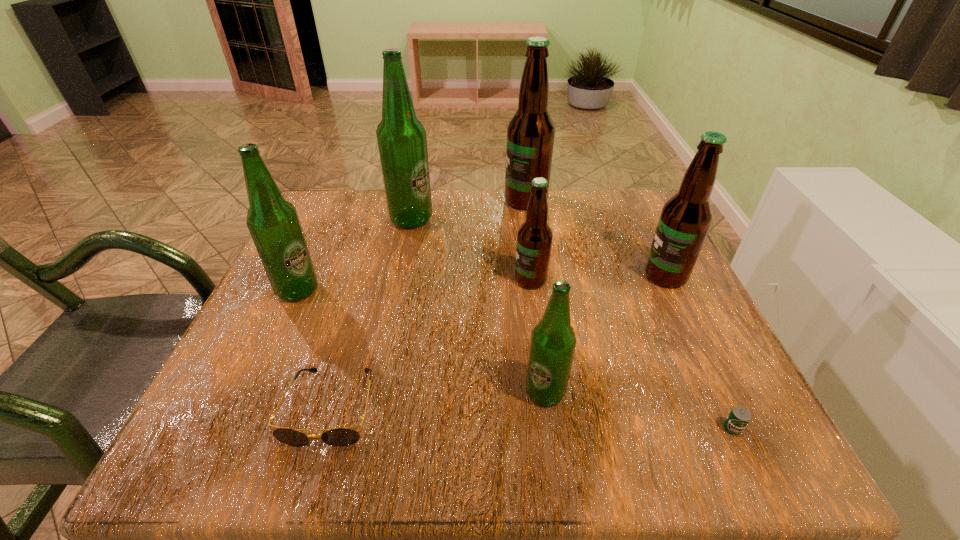
The image size is (960, 540). I want to click on beer bottle situated at the right edge, so click(685, 219).

Where is `beer can that is at the right edge`? This screenshot has width=960, height=540. beer can that is at the right edge is located at coordinates (739, 417).

Find the location of a particular element. object at the near left corner is located at coordinates [x=342, y=436].

The height and width of the screenshot is (540, 960). I want to click on object positioned at the near right corner, so click(x=739, y=417).

Image resolution: width=960 pixels, height=540 pixels. I want to click on vacant space at the far edge, so click(569, 222).

Where is `vacant space at the near edge`? vacant space at the near edge is located at coordinates (525, 418).

Find the location of a particular element. This screenshot has height=540, width=960. blank area at the left edge is located at coordinates (234, 372).

What are the coordinates of `free space at the right edge` in the screenshot? It's located at (683, 309).

The image size is (960, 540). Find the location of `free spot at the far left corner of the desktop`. free spot at the far left corner of the desktop is located at coordinates (308, 218).

In order to click on free space at the far right corner of the desktop in this screenshot , I will do `click(613, 204)`.